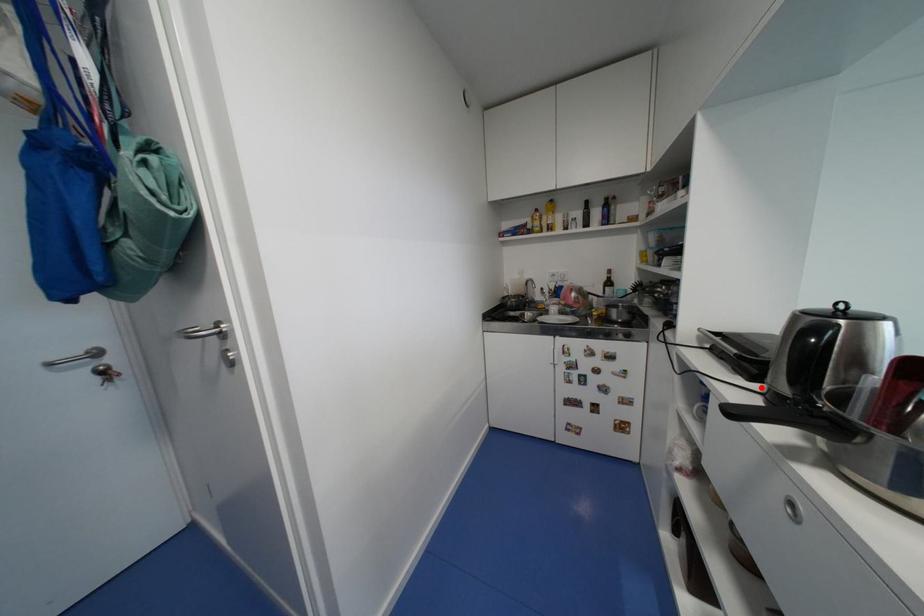
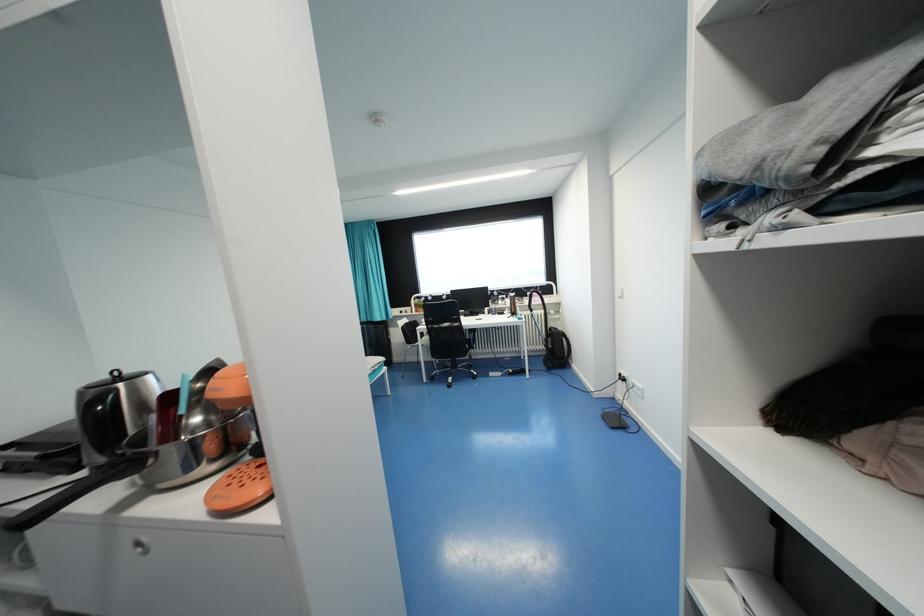
Locate, in the second image, the point that corresponds to the highlighted location in the first image.

(88, 475)